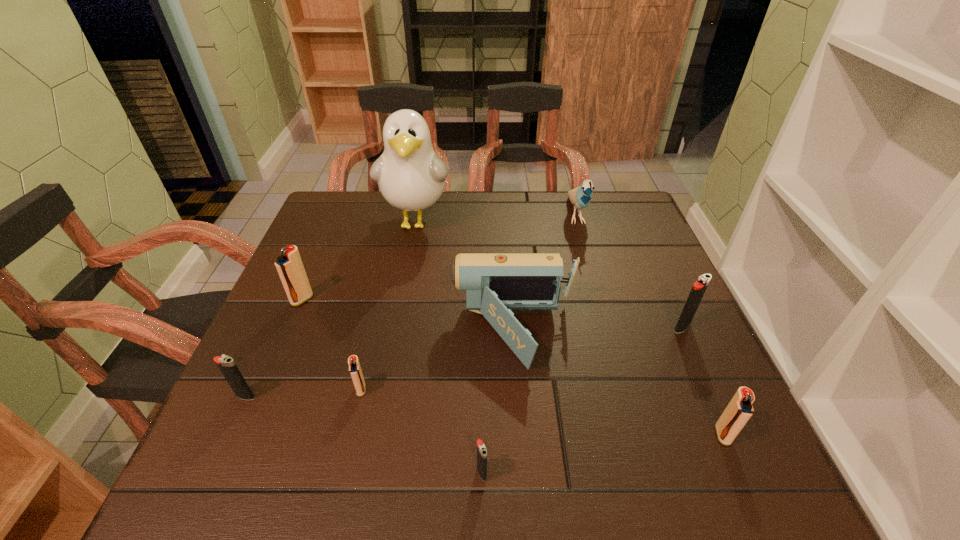
Find the location of a particular element. Image resolution: width=960 pixels, height=540 pixels. vacant space located 0.070m on the side of the camcorder with the flip-out screen is located at coordinates (419, 333).

Where is `free region located on the side of the camcorder with the flip-out screen`? free region located on the side of the camcorder with the flip-out screen is located at coordinates (318, 333).

This screenshot has width=960, height=540. In order to click on free spot located on the right of the farthest igniter in this screenshot , I will do `click(418, 300)`.

The width and height of the screenshot is (960, 540). I want to click on vacant space situated on the back of the farthest black igniter, so click(645, 245).

Where is `vacant area situated 0.400m on the back of the second smallest black igniter`? The image size is (960, 540). vacant area situated 0.400m on the back of the second smallest black igniter is located at coordinates (307, 260).

You are a GUI agent. You are given a task and a screenshot of the screen. Output one action in this format:
    pyautogui.click(x=<x>, y=<y>)
    Task: Click on the free point located 0.170m on the back of the rightmost red igniter
    This screenshot has height=540, width=960.
    Given the screenshot: What is the action you would take?
    pyautogui.click(x=685, y=349)

This screenshot has height=540, width=960. Find the location of `free point located on the back of the third igniter from left to right`. free point located on the back of the third igniter from left to right is located at coordinates tap(371, 347).

Locate an element on the screen. This screenshot has height=540, width=960. vacant space located on the right of the smallest black igniter is located at coordinates (726, 472).

Identify the location of gull at the far edge. The width and height of the screenshot is (960, 540). (411, 177).

You are a GUI agent. You are given a task and a screenshot of the screen. Output one action in this format:
    pyautogui.click(x=<x>, y=<y>)
    Task: Click on the bird that is at the far edge
    This screenshot has height=540, width=960.
    Given the screenshot: What is the action you would take?
    pyautogui.click(x=581, y=196)